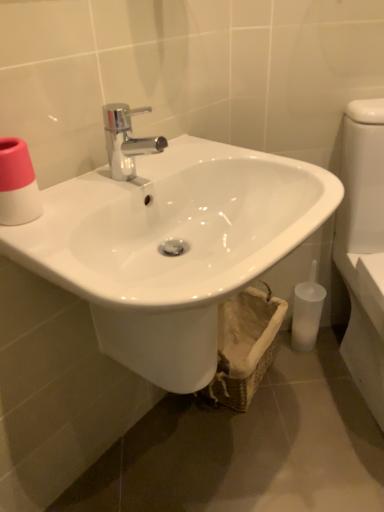
Question: From the image's perspective, is pink matte toilet paper at upper left above translucent plastic toilet brush at lower right?

Choices:
 (A) no
 (B) yes

Answer: (B)

Question: Is pink matte toilet paper at upper left to the right of translucent plastic toilet brush at lower right from the viewer's perspective?

Choices:
 (A) no
 (B) yes

Answer: (A)

Question: Is pink matte toilet paper at upper left positioned behind translucent plastic toilet brush at lower right?

Choices:
 (A) no
 (B) yes

Answer: (A)

Question: Is pink matte toilet paper at upper left facing towards translucent plastic toilet brush at lower right?

Choices:
 (A) yes
 (B) no

Answer: (B)

Question: Does pink matte toilet paper at upper left have a greater width compared to translucent plastic toilet brush at lower right?

Choices:
 (A) yes
 (B) no

Answer: (B)

Question: In terms of height, does white glossy sink at center look taller or shorter compared to pink matte toilet paper at upper left?

Choices:
 (A) short
 (B) tall

Answer: (B)

Question: From the image's perspective, relative to pink matte toilet paper at upper left, is white glossy sink at center above or below?

Choices:
 (A) below
 (B) above

Answer: (A)

Question: From a real-world perspective, is white glossy sink at center physically located above or below pink matte toilet paper at upper left?

Choices:
 (A) above
 (B) below

Answer: (B)

Question: Is white glossy sink at center situated inside pink matte toilet paper at upper left or outside?

Choices:
 (A) outside
 (B) inside

Answer: (A)

Question: Is translucent plastic toilet brush at lower right in front of or behind woven beige basket at lower center in the image?

Choices:
 (A) front
 (B) behind

Answer: (B)

Question: From the image's perspective, is translucent plastic toilet brush at lower right located above or below woven beige basket at lower center?

Choices:
 (A) below
 (B) above

Answer: (B)

Question: In terms of width, does translucent plastic toilet brush at lower right look wider or thinner when compared to woven beige basket at lower center?

Choices:
 (A) wide
 (B) thin

Answer: (B)

Question: Is point (299, 286) positioned closer to the camera than point (253, 366)?

Choices:
 (A) farther
 (B) closer

Answer: (A)

Question: In the image, is pink matte toilet paper at upper left on the left side or the right side of white glossy sink at center?

Choices:
 (A) left
 (B) right

Answer: (A)

Question: Considering their positions, is pink matte toilet paper at upper left located in front of or behind white glossy sink at center?

Choices:
 (A) behind
 (B) front

Answer: (A)